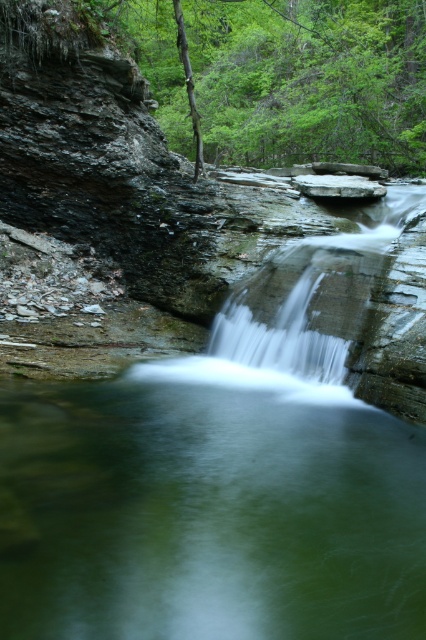
Does green translucent water at center appear on the right side of white smooth waterfall at center?

Incorrect, green translucent water at center is not on the right side of white smooth waterfall at center.

Does green translucent water at center appear under white smooth waterfall at center?

Correct, green translucent water at center is located below white smooth waterfall at center.

The height and width of the screenshot is (640, 426). Describe the element at coordinates (207, 515) in the screenshot. I see `green translucent water at center` at that location.

This screenshot has height=640, width=426. Identify the location of green translucent water at center. (207, 515).